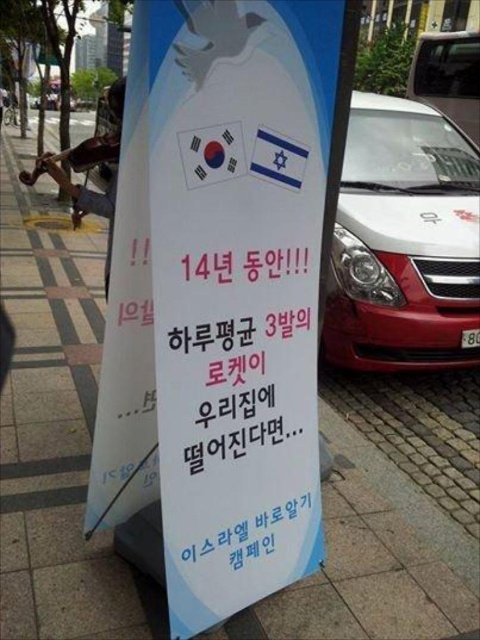
Is point (432, 150) farther from viewer compared to point (450, 76)?

No, it is in front of (450, 76).

Is white glossy car at center wider than metallic silver car at center?

Correct, the width of white glossy car at center exceeds that of metallic silver car at center.

The height and width of the screenshot is (640, 480). What are the coordinates of `white glossy car at center` in the screenshot? It's located at (405, 241).